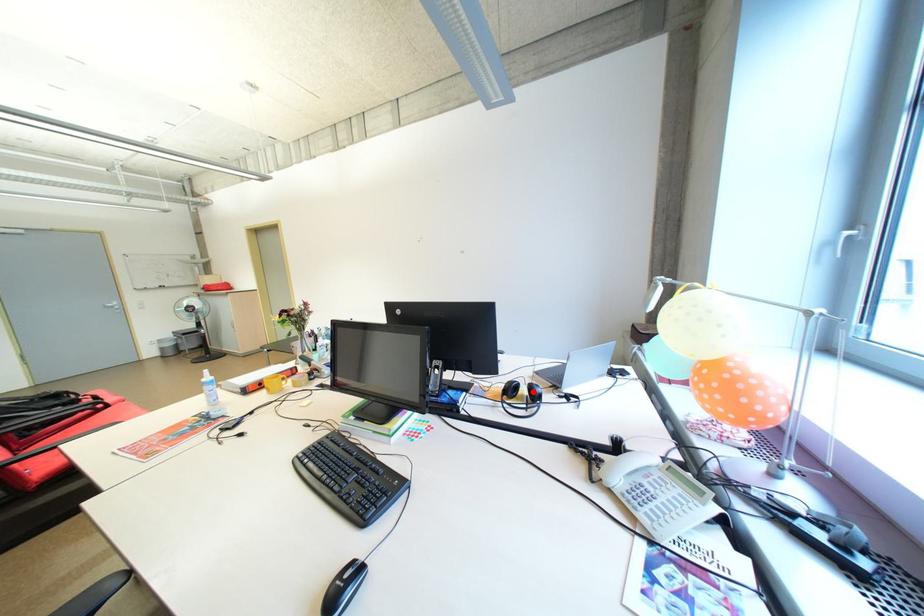
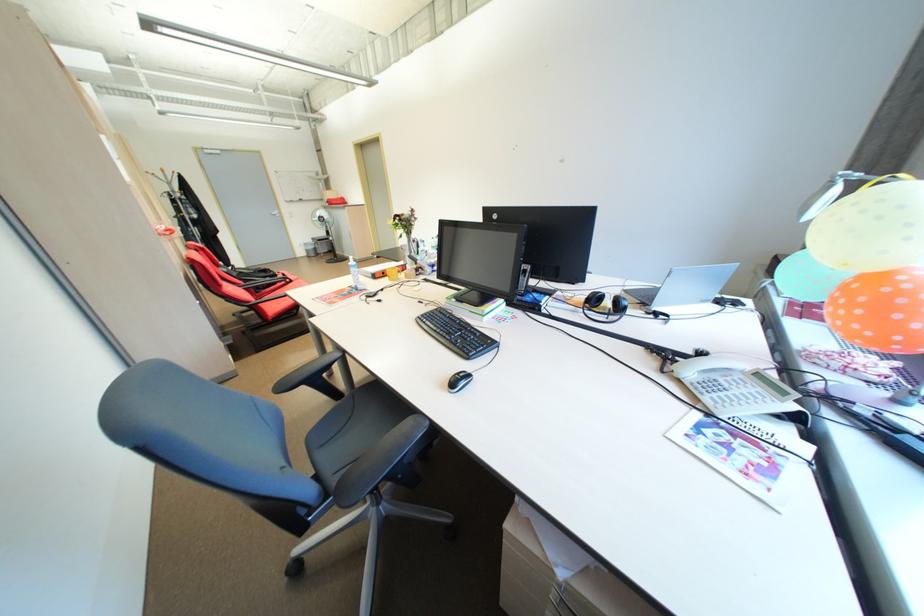
The point at the highlighted location is marked in the first image. Where is the corresponding point in the second image?

(616, 304)